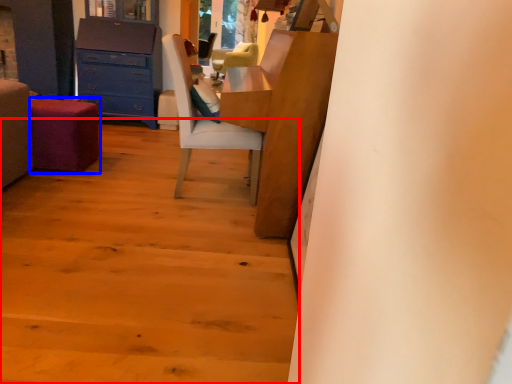
Question: Which of the following is the farthest to the observer, stairwell (highlighted by a red box) or stool (highlighted by a blue box)?

Choices:
 (A) stairwell
 (B) stool

Answer: (B)